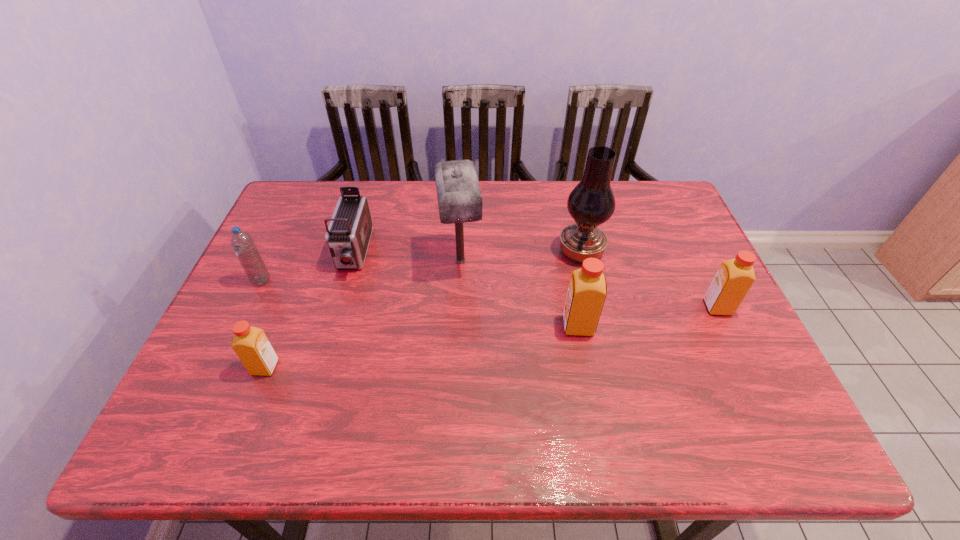
This screenshot has width=960, height=540. I want to click on vacant area located on the front and back of the second orange juice from left to right, so click(481, 326).

Image resolution: width=960 pixels, height=540 pixels. I want to click on vacant area situated 0.330m on the front and back of the second orange juice from left to right, so click(x=427, y=326).

Where is `vacant region located 0.280m on the front and back of the second orange juice from left to right`? The height and width of the screenshot is (540, 960). vacant region located 0.280m on the front and back of the second orange juice from left to right is located at coordinates (448, 326).

In order to click on free region located 0.130m at the lens of the third object from left to right in this screenshot , I will do `click(334, 320)`.

Locate an element on the screen. The image size is (960, 540). vacant space situated 0.090m on the right of the oil lamp is located at coordinates (636, 252).

Find the location of a particular element. The height and width of the screenshot is (540, 960). vacant area situated 0.210m on the front of the fourth object from left to right is located at coordinates (457, 349).

The image size is (960, 540). Identify the location of blank area located on the right of the water bottle. (379, 281).

The image size is (960, 540). What are the coordinates of `object present at the near edge` in the screenshot? It's located at (251, 345).

At what (x,y) coordinates should I click in order to perform the action: click on orange juice that is at the left edge. Please return your answer as a coordinate pair (x, y). The width and height of the screenshot is (960, 540). Looking at the image, I should click on (251, 345).

Locate an element on the screen. The height and width of the screenshot is (540, 960). water bottle situated at the left edge is located at coordinates (243, 245).